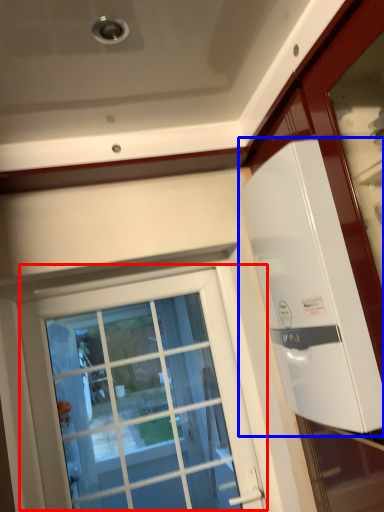
Question: Which of the following is the farthest to the observer, window (highlighted by a red box) or appliance (highlighted by a blue box)?

Choices:
 (A) window
 (B) appliance

Answer: (A)